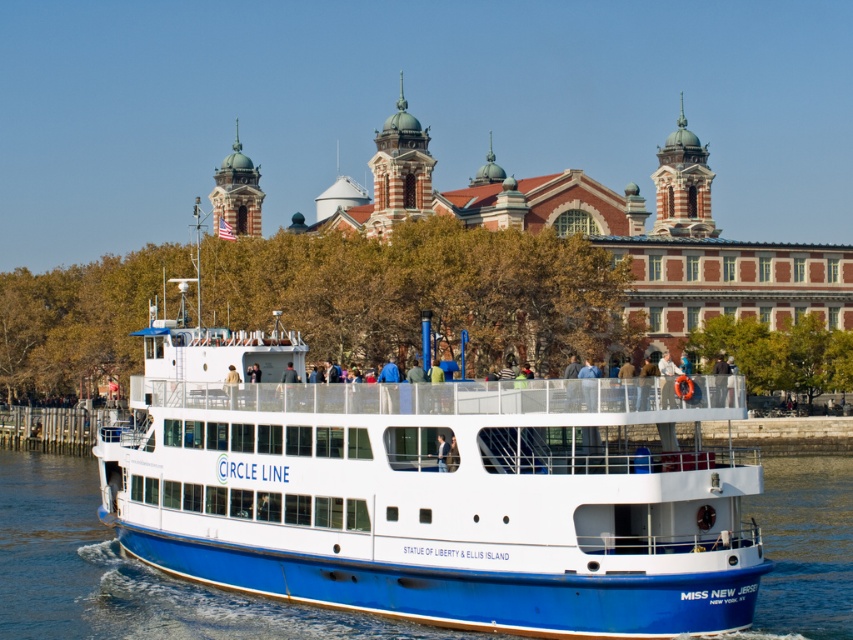
Is point (491, 563) less distant than point (109, 595)?

Yes, point (491, 563) is closer to viewer.

The width and height of the screenshot is (853, 640). Describe the element at coordinates (433, 490) in the screenshot. I see `blue matte ferry at center` at that location.

In order to click on blue matte ferry at center in this screenshot , I will do `click(433, 490)`.